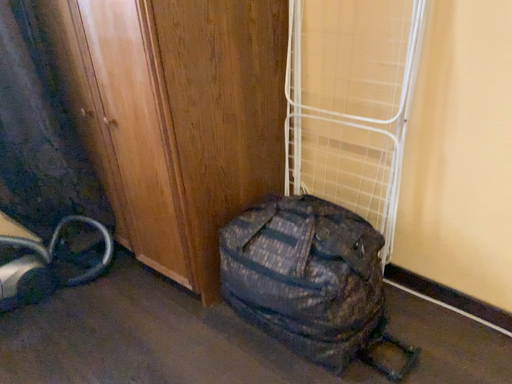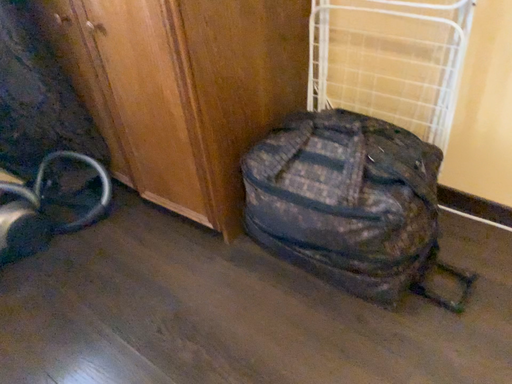
Question: How did the camera likely rotate when shooting the video?

Choices:
 (A) rotated upward
 (B) rotated downward

Answer: (B)